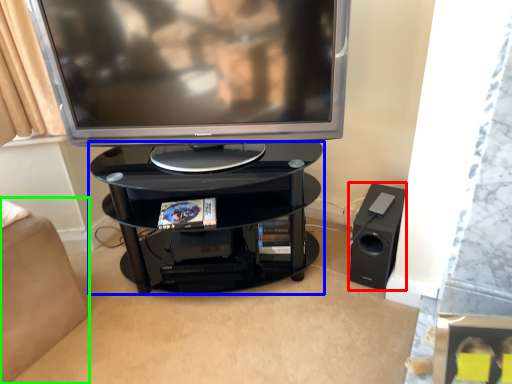
Question: Which object is the closest to the speaker (highlighted by a red box)? Choose among these: shelf (highlighted by a blue box) or furniture (highlighted by a green box).

Choices:
 (A) shelf
 (B) furniture

Answer: (A)